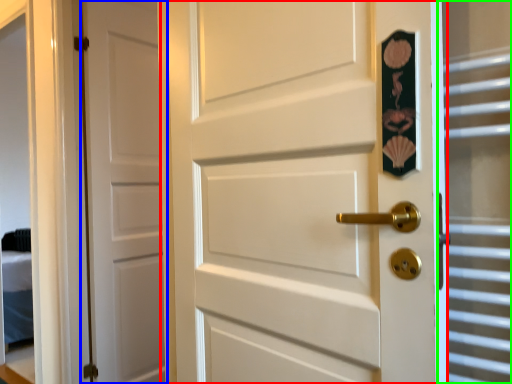
Question: Considering the real-world distances, which object is closest to door (highlighted by a red box)? door (highlighted by a blue box) or glass door (highlighted by a green box).

Choices:
 (A) door
 (B) glass door

Answer: (B)